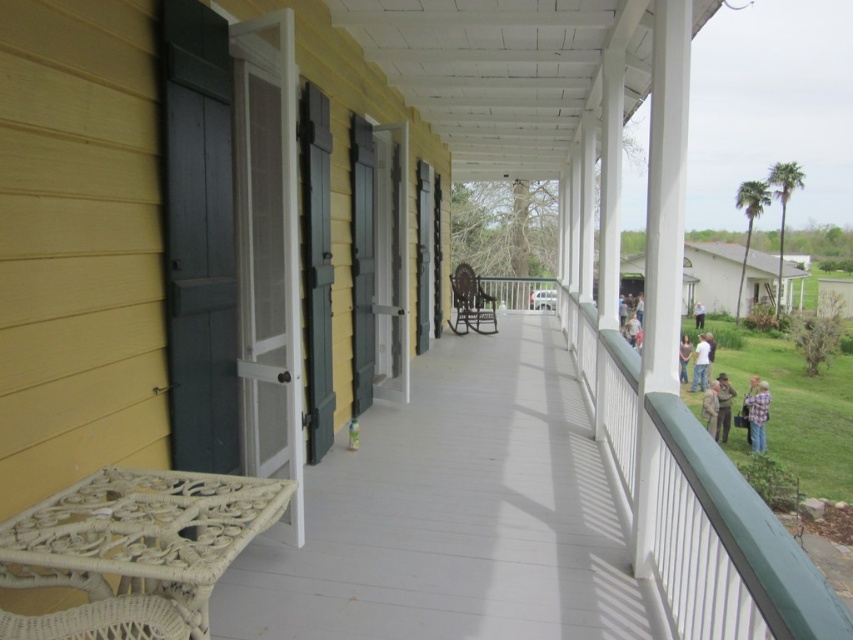
Question: Which object is positioned farthest from the white wicker balustrade at lower left?

Choices:
 (A) white wicker table at lower left
 (B) light brown leather jacket at lower right
 (C) brown leather jacket at lower right

Answer: (C)

Question: Is light brown leather jacket at lower right above light brown wooden chair at center?

Choices:
 (A) yes
 (B) no

Answer: (B)

Question: Which of these objects is positioned farthest from the white wicker table at lower left?

Choices:
 (A) blue plaid shirt at lower right
 (B) white cotton shirt at center

Answer: (B)

Question: Can you confirm if white wicker balustrade at lower left is smaller than denim jacket at center?

Choices:
 (A) yes
 (B) no

Answer: (A)

Question: Does white wicker table at lower left have a smaller size compared to white wicker balustrade at lower left?

Choices:
 (A) no
 (B) yes

Answer: (B)

Question: Which object is closer to the camera taking this photo?

Choices:
 (A) blue plaid shirt at lower right
 (B) denim jacket at center
 (C) blue denim jeans at lower right

Answer: (B)